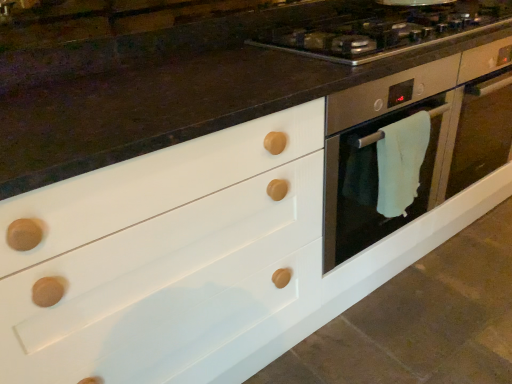
Question: In the image, is satin silver gas stove at upper center on the left side or the right side of satin silver oven at center right?

Choices:
 (A) right
 (B) left

Answer: (B)

Question: Considering the positions of point (294, 34) and point (470, 157), is point (294, 34) closer or farther from the camera than point (470, 157)?

Choices:
 (A) closer
 (B) farther

Answer: (A)

Question: Considering the real-world distances, which object is closest to the white towel at right?

Choices:
 (A) satin silver gas stove at upper center
 (B) satin silver oven at center right

Answer: (B)

Question: Which of these objects is positioned closest to the white towel at right?

Choices:
 (A) satin silver gas stove at upper center
 (B) satin silver oven at center right

Answer: (B)